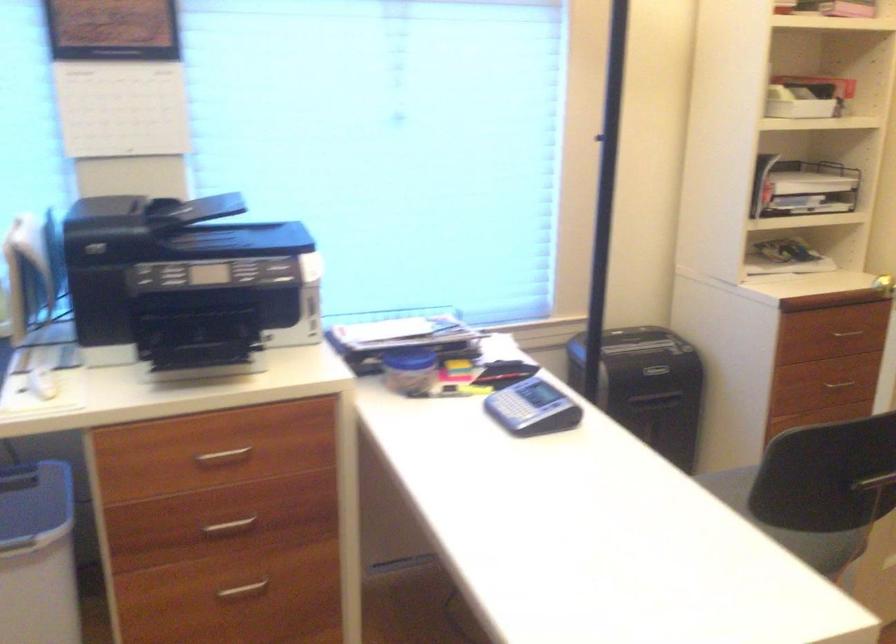
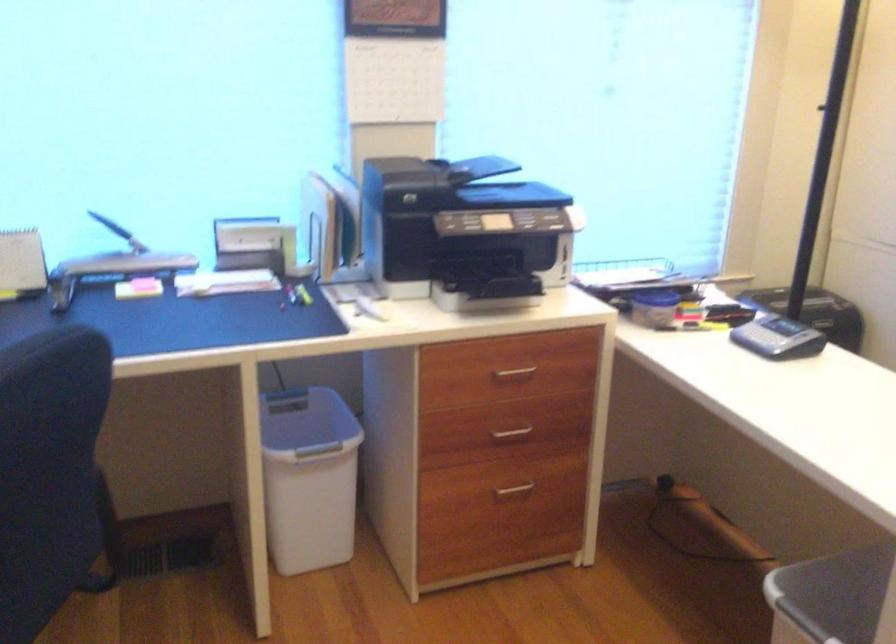
Question: I am providing you with two images of the same scene from different viewpoints. Which of the following objects are not visible in image2?

Choices:
 (A) gray monitor arm
 (B) shredder bin
 (C) label maker
 (D) beige toolbox handle

Answer: (B)